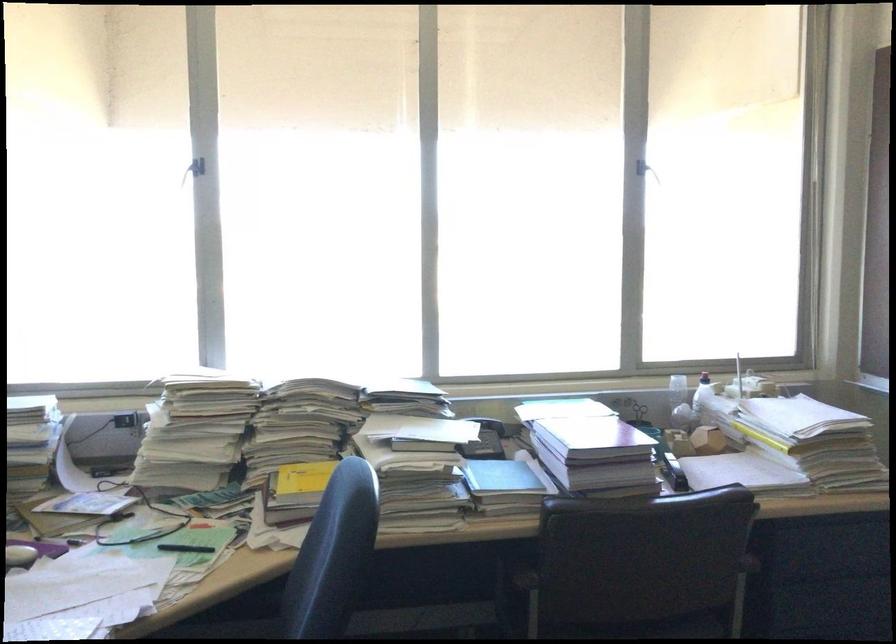
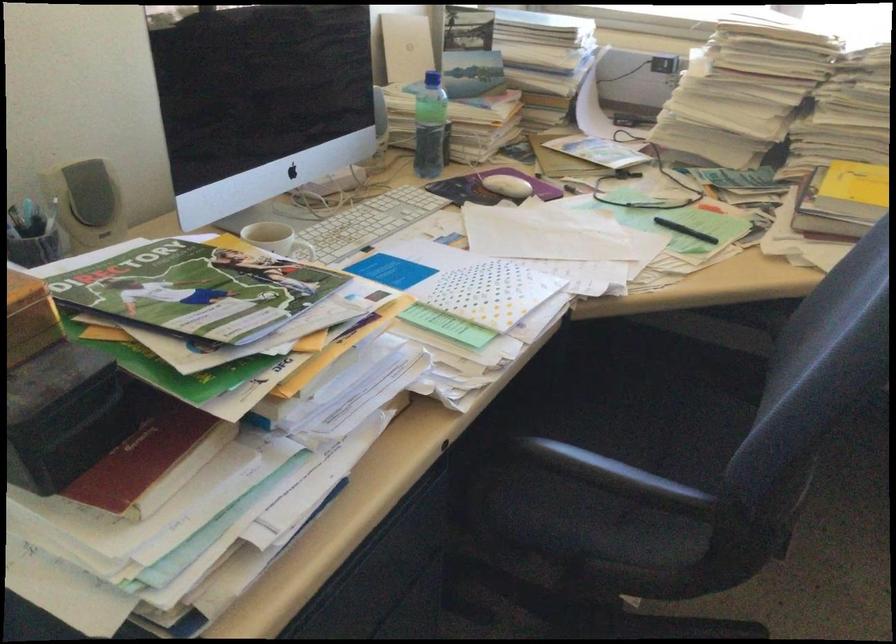
The point at (186, 552) is marked in the first image. Where is the corresponding point in the second image?

(684, 230)